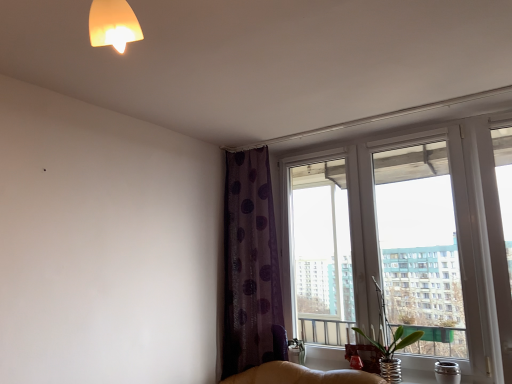
Image resolution: width=512 pixels, height=384 pixels. What do you see at coordinates (406, 243) in the screenshot? I see `transparent glass window at upper right` at bounding box center [406, 243].

In order to face green glass vase at window, should I rotate leftwards or rightwards?

A 17.139 degree turn to the right will do.

The width and height of the screenshot is (512, 384). I want to click on transparent glass window at upper right, so click(406, 243).

Are purple dotted fabric at upper center and transparent glass window at upper right making contact?

There is a gap between purple dotted fabric at upper center and transparent glass window at upper right.

Considering the sizes of objects purple dotted fabric at upper center and transparent glass window at upper right in the image provided, who is wider, purple dotted fabric at upper center or transparent glass window at upper right?

purple dotted fabric at upper center.

Between purple dotted fabric at upper center and transparent glass window at upper right, which one has more height?

purple dotted fabric at upper center.

Which is in front, purple dotted fabric at upper center or transparent glass window at upper right?

transparent glass window at upper right is more forward.

Is green glass vase at window wider or thinner than transparent glass window at upper right?

Clearly, green glass vase at window has more width compared to transparent glass window at upper right.

Which is more to the left, green glass vase at window or transparent glass window at upper right?

From the viewer's perspective, transparent glass window at upper right appears more on the left side.

Considering the relative sizes of green glass vase at window and transparent glass window at upper right in the image provided, is green glass vase at window shorter than transparent glass window at upper right?

Indeed, green glass vase at window has a lesser height compared to transparent glass window at upper right.

From a real-world perspective, is green glass vase at window above or below transparent glass window at upper right?

In terms of real-world spatial position, green glass vase at window is below transparent glass window at upper right.

Based on the photo, can we say transparent glass window at upper right lies outside purple dotted fabric at upper center?

Indeed, transparent glass window at upper right is completely outside purple dotted fabric at upper center.

Can you confirm if transparent glass window at upper right is positioned to the left of purple dotted fabric at upper center?

Incorrect, transparent glass window at upper right is not on the left side of purple dotted fabric at upper center.

From the image's perspective, between transparent glass window at upper right and purple dotted fabric at upper center, who is located below?

purple dotted fabric at upper center, from the image's perspective.

Is green glass vase at window looking in the opposite direction of purple dotted fabric at upper center?

green glass vase at window does not have its back to purple dotted fabric at upper center.

Which object is further away from the camera, green glass vase at window or purple dotted fabric at upper center?

Positioned behind is purple dotted fabric at upper center.

Looking at this image, from a real-world perspective, which object stands above the other?

purple dotted fabric at upper center, from a real-world perspective.

Looking at their sizes, would you say purple dotted fabric at upper center is wider or thinner than green glass vase at window?

In the image, purple dotted fabric at upper center appears to be more narrow than green glass vase at window.

From the image's perspective, relative to green glass vase at window, is purple dotted fabric at upper center above or below?

purple dotted fabric at upper center is situated higher than green glass vase at window in the image.

Where is `curtain that is above the green glass vase at window (from a real-world perspective)`? The width and height of the screenshot is (512, 384). curtain that is above the green glass vase at window (from a real-world perspective) is located at coordinates (250, 265).

Does purple dotted fabric at upper center turn towards green glass vase at window?

No, purple dotted fabric at upper center is not turned towards green glass vase at window.

Is green glass vase at window at the back of transparent glass window at upper right?

Absolutely, transparent glass window at upper right is directed away from green glass vase at window.

Is transparent glass window at upper right taller than green glass vase at window?

Indeed, transparent glass window at upper right has a greater height compared to green glass vase at window.

From a real-world perspective, is transparent glass window at upper right physically located above or below green glass vase at window?

From a real-world perspective, transparent glass window at upper right is physically above green glass vase at window.

Find the location of `curtain directly beneath the transparent glass window at upper right (from a real-world perspective)`. curtain directly beneath the transparent glass window at upper right (from a real-world perspective) is located at coordinates (250, 265).

Find the location of a particular element. This screenshot has width=512, height=384. window that appears in front of the green glass vase at window is located at coordinates (406, 243).

Based on the photo, based on their spatial positions, is transparent glass window at upper right or green glass vase at window further from purple dotted fabric at upper center?

Based on the image, green glass vase at window appears to be further to purple dotted fabric at upper center.

Looking at the image, which one is located further to purple dotted fabric at upper center, green glass vase at window or transparent glass window at upper right?

Among the two, green glass vase at window is located further to purple dotted fabric at upper center.

From the picture: When comparing their distances from transparent glass window at upper right, does green glass vase at window or purple dotted fabric at upper center seem further?

green glass vase at window is positioned further to the anchor transparent glass window at upper right.

Which object lies nearer to the anchor point green glass vase at window, transparent glass window at upper right or purple dotted fabric at upper center?

transparent glass window at upper right is positioned closer to the anchor green glass vase at window.

From the image, which object appears to be nearer to transparent glass window at upper right, purple dotted fabric at upper center or green glass vase at window?

Among the two, purple dotted fabric at upper center is located nearer to transparent glass window at upper right.

Based on their spatial positions, is purple dotted fabric at upper center or transparent glass window at upper right further from green glass vase at window?

purple dotted fabric at upper center.

Locate an element on the screen. This screenshot has height=384, width=512. window between purple dotted fabric at upper center and green glass vase at window in the horizontal direction is located at coordinates (406, 243).